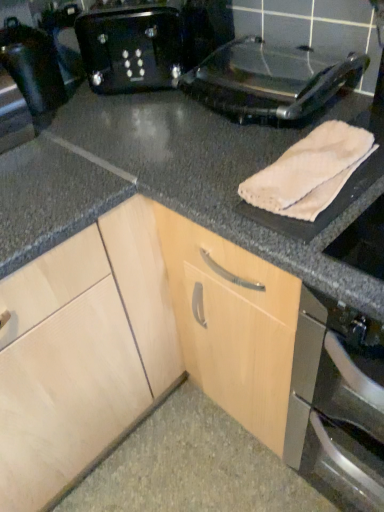
This screenshot has height=512, width=384. I want to click on free space in front of metallic black toaster at upper right, so click(229, 172).